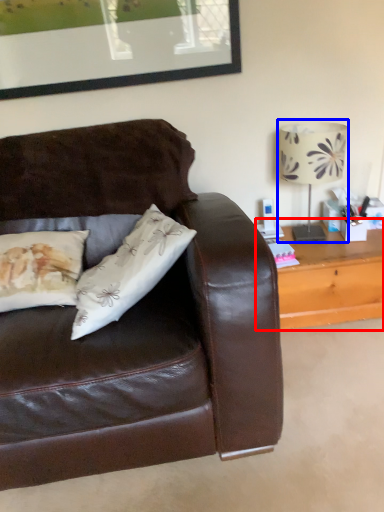
Question: Which object appears closest to the camera in this image, table (highlighted by a red box) or table lamp (highlighted by a blue box)?

Choices:
 (A) table
 (B) table lamp

Answer: (B)